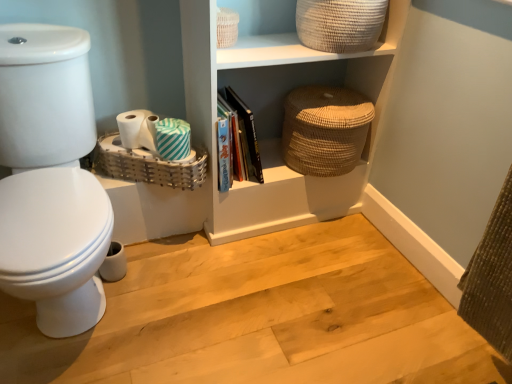
Question: Relative to teal striped toilet paper at center, which is counted as the third toilet paper, starting from the left, is wooden floor at lower left in front or behind?

Choices:
 (A) front
 (B) behind

Answer: (A)

Question: Considering the positions of point (232, 372) and point (181, 130), is point (232, 372) closer or farther from the camera than point (181, 130)?

Choices:
 (A) farther
 (B) closer

Answer: (B)

Question: Which of these objects is positioned closest to the natural woven basket at upper right?

Choices:
 (A) white matte toilet paper at lower left, which appears as the 3th toilet paper when viewed from the right
 (B) woven beige basket at upper right, the first basket viewed from the right
 (C) hardcover books at center
 (D) wooden floor at lower left
 (E) beige woven basket at upper center, which is the 2th basket from left to right

Answer: (B)

Question: Which object is the closest to the wooden floor at lower left?

Choices:
 (A) teal striped toilet paper at center, the second toilet paper from the left
 (B) hardcover books at center
 (C) teal striped toilet paper at center, arranged as the first toilet paper when viewed from the right
 (D) natural woven basket at upper right
 (E) beige woven basket at upper center, which is the 2th basket from left to right

Answer: (D)